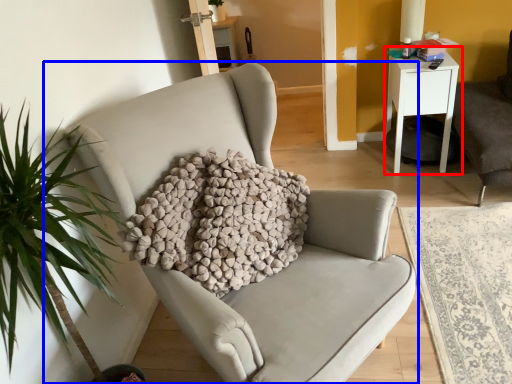
Question: Which object appears closest to the camera in this image, nightstand (highlighted by a red box) or chair (highlighted by a blue box)?

Choices:
 (A) nightstand
 (B) chair

Answer: (B)